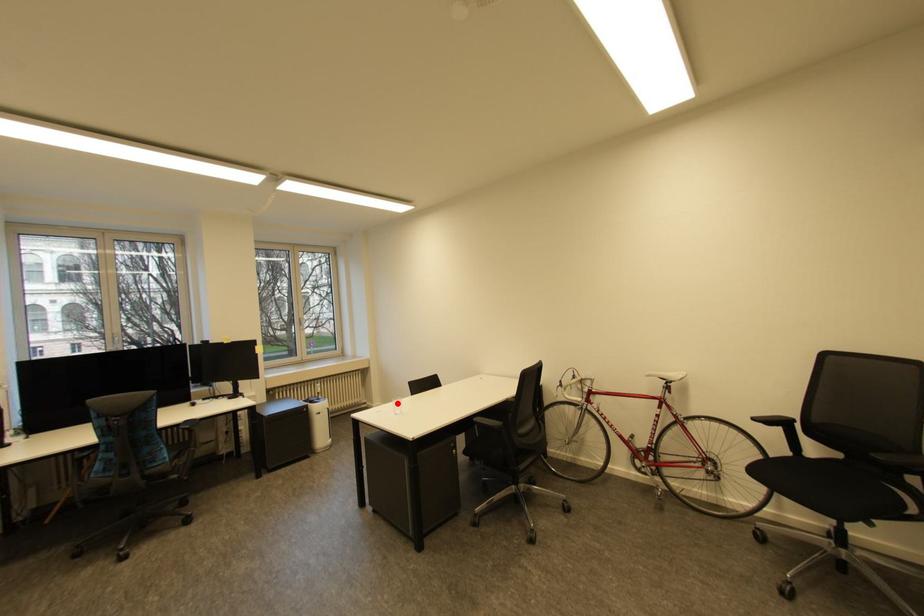
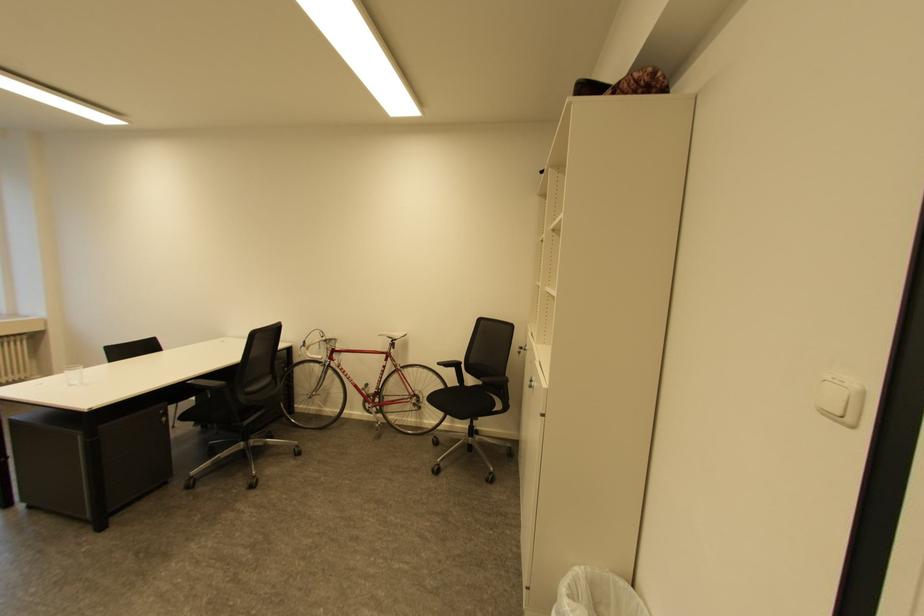
Locate, in the second image, the point that corresponds to the highlighted location in the first image.

(70, 371)